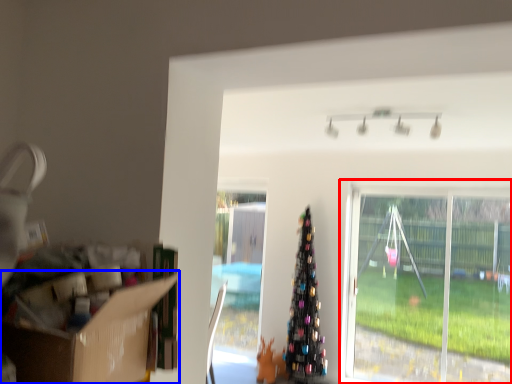
Question: Which object is further to the camera taking this photo, window (highlighted by a red box) or cardboard box (highlighted by a blue box)?

Choices:
 (A) window
 (B) cardboard box

Answer: (A)